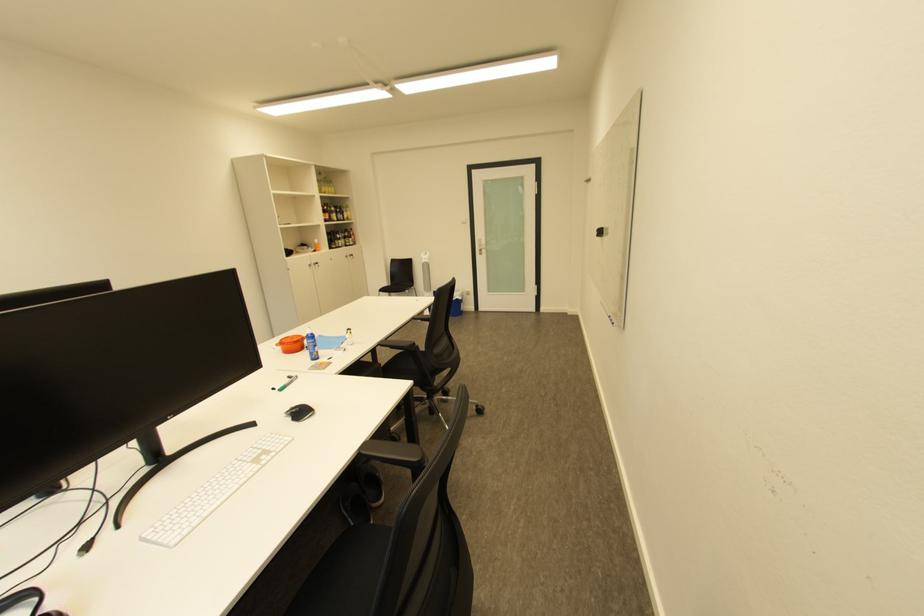
Where is `whiteboard eraser`? This screenshot has width=924, height=616. whiteboard eraser is located at coordinates (601, 232).